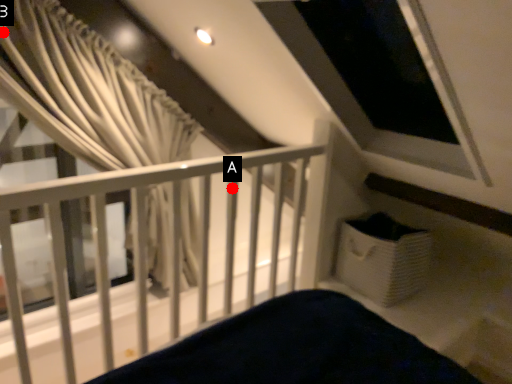
Question: Two points are circled on the image, labeled by A and B beside each circle. Which of the following is the farthest from the observer?

Choices:
 (A) A is further
 (B) B is further

Answer: (A)